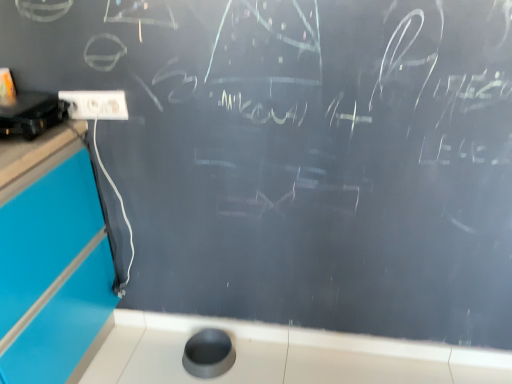
Question: Can you confirm if white plastic electric outlet at upper left is positioned to the left of black plastic projector at upper left?

Choices:
 (A) no
 (B) yes

Answer: (A)

Question: Does white plastic electric outlet at upper left have a greater height compared to black plastic projector at upper left?

Choices:
 (A) no
 (B) yes

Answer: (A)

Question: Could you tell me if white plastic electric outlet at upper left is facing black plastic projector at upper left?

Choices:
 (A) no
 (B) yes

Answer: (B)

Question: Does white plastic electric outlet at upper left have a smaller size compared to black plastic projector at upper left?

Choices:
 (A) yes
 (B) no

Answer: (A)

Question: From the image's perspective, is white plastic electric outlet at upper left under black plastic projector at upper left?

Choices:
 (A) no
 (B) yes

Answer: (A)

Question: Does white plastic electric outlet at upper left have a greater width compared to black plastic projector at upper left?

Choices:
 (A) yes
 (B) no

Answer: (B)

Question: Does white glossy counter top at lower center lie behind white plastic electric outlet at upper left?

Choices:
 (A) yes
 (B) no

Answer: (A)

Question: Is the position of white glossy counter top at lower center less distant than that of white plastic electric outlet at upper left?

Choices:
 (A) no
 (B) yes

Answer: (A)

Question: Is white glossy counter top at lower center positioned beyond the bounds of white plastic electric outlet at upper left?

Choices:
 (A) yes
 (B) no

Answer: (A)

Question: From the image's perspective, does white glossy counter top at lower center appear lower than white plastic electric outlet at upper left?

Choices:
 (A) yes
 (B) no

Answer: (A)

Question: Considering the relative sizes of white glossy counter top at lower center and white plastic electric outlet at upper left in the image provided, is white glossy counter top at lower center bigger than white plastic electric outlet at upper left?

Choices:
 (A) no
 (B) yes

Answer: (B)

Question: Is white glossy counter top at lower center to the left of white plastic electric outlet at upper left from the viewer's perspective?

Choices:
 (A) yes
 (B) no

Answer: (B)

Question: From a real-world perspective, does black plastic projector at upper left stand above white glossy counter top at lower center?

Choices:
 (A) yes
 (B) no

Answer: (A)